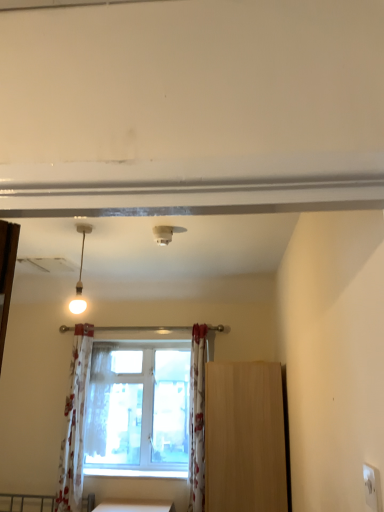
Question: Does clear glass window at center lie behind white plastic electric outlet at lower right?

Choices:
 (A) no
 (B) yes

Answer: (B)

Question: From a real-world perspective, does clear glass window at center sit lower than white plastic electric outlet at lower right?

Choices:
 (A) yes
 (B) no

Answer: (B)

Question: Can you confirm if clear glass window at center is bigger than white plastic electric outlet at lower right?

Choices:
 (A) no
 (B) yes

Answer: (B)

Question: From a real-world perspective, is clear glass window at center on white plastic electric outlet at lower right?

Choices:
 (A) no
 (B) yes

Answer: (B)

Question: Is clear glass window at center at the right side of white plastic electric outlet at lower right?

Choices:
 (A) no
 (B) yes

Answer: (A)

Question: Is point (206, 499) positioned closer to the camera than point (69, 302)?

Choices:
 (A) closer
 (B) farther

Answer: (B)

Question: Is light brown wood cabinet at right taller or shorter than matte white pendant light at upper left?

Choices:
 (A) short
 (B) tall

Answer: (B)

Question: From the image's perspective, relative to matte white pendant light at upper left, is light brown wood cabinet at right above or below?

Choices:
 (A) below
 (B) above

Answer: (A)

Question: From a real-world perspective, is light brown wood cabinet at right physically located above or below matte white pendant light at upper left?

Choices:
 (A) below
 (B) above

Answer: (A)

Question: Is white plastic smoke detector at upper center inside or outside of white floral fabric at center?

Choices:
 (A) outside
 (B) inside

Answer: (A)

Question: In terms of size, does white plastic smoke detector at upper center appear bigger or smaller than white floral fabric at center?

Choices:
 (A) small
 (B) big

Answer: (A)

Question: From a real-world perspective, is white plastic smoke detector at upper center positioned above or below white floral fabric at center?

Choices:
 (A) above
 (B) below

Answer: (A)

Question: Is white plastic smoke detector at upper center taller or shorter than white floral fabric at center?

Choices:
 (A) tall
 (B) short

Answer: (B)

Question: From their relative heights in the image, would you say white floral fabric at center is taller or shorter than white plastic electric outlet at lower right?

Choices:
 (A) short
 (B) tall

Answer: (B)

Question: From a real-world perspective, relative to white plastic electric outlet at lower right, is white floral fabric at center vertically above or below?

Choices:
 (A) above
 (B) below

Answer: (A)